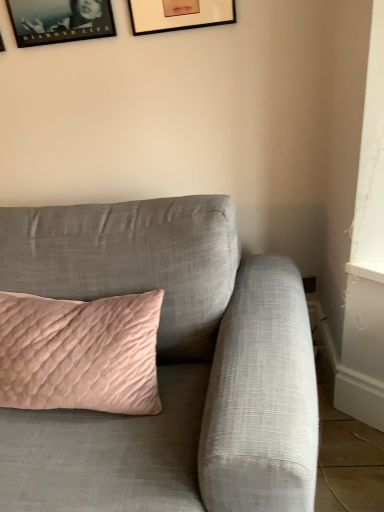
Identify the location of matte black picture frame at upper left, positioned as the 3th picture frame in right-to-left order. click(x=1, y=44).

Is matte black picture frame at upper left, which is counted as the first picture frame, starting from the left, taller or shorter than matte black picture frame at upper left, the second picture frame from the left?

In the image, matte black picture frame at upper left, which is counted as the first picture frame, starting from the left, appears to be taller than matte black picture frame at upper left, the second picture frame from the left.

Consider the image. Measure the distance between matte black picture frame at upper left, which is counted as the first picture frame, starting from the left, and matte black picture frame at upper left, placed as the 2th picture frame when sorted from right to left.

8.08 inches.

From a real-world perspective, is matte black picture frame at upper left, which is counted as the first picture frame, starting from the left, positioned under matte black picture frame at upper left, placed as the 2th picture frame when sorted from right to left, based on gravity?

Correct, in the physical world, matte black picture frame at upper left, which is counted as the first picture frame, starting from the left, is lower than matte black picture frame at upper left, placed as the 2th picture frame when sorted from right to left.

Is matte black picture frame at upper left, positioned as the 3th picture frame in right-to-left order, positioned before matte black picture frame at upper left, placed as the 2th picture frame when sorted from right to left?

No.

How different are the orientations of matte black picture frame at upper center, marked as the 3th picture frame in a left-to-right arrangement, and matte gray couch at center in degrees?

The facing directions of matte black picture frame at upper center, marked as the 3th picture frame in a left-to-right arrangement, and matte gray couch at center are 5.73 degrees apart.

How far apart are matte black picture frame at upper center, which appears as the first picture frame when viewed from the right, and matte gray couch at center?

They are 90.03 centimeters apart.

Does matte black picture frame at upper center, marked as the 3th picture frame in a left-to-right arrangement, have a larger size compared to matte gray couch at center?

Actually, matte black picture frame at upper center, marked as the 3th picture frame in a left-to-right arrangement, might be smaller than matte gray couch at center.

Locate an element on the screen. Image resolution: width=384 pixels, height=512 pixels. studio couch lying on the left of matte black picture frame at upper center, marked as the 3th picture frame in a left-to-right arrangement is located at coordinates (169, 365).

Would you say matte black picture frame at upper left, the second picture frame from the left, is to the left or to the right of matte gray couch at center in the picture?

In the image, matte black picture frame at upper left, the second picture frame from the left, appears on the left side of matte gray couch at center.

How different are the orientations of matte black picture frame at upper left, placed as the 2th picture frame when sorted from right to left, and matte gray couch at center in degrees?

They differ by 5.73 degrees in their facing directions.

Which is correct: matte black picture frame at upper left, placed as the 2th picture frame when sorted from right to left, is inside matte gray couch at center, or outside of it?

matte black picture frame at upper left, placed as the 2th picture frame when sorted from right to left, exists outside the volume of matte gray couch at center.

Does matte gray couch at center appear on the right side of matte black picture frame at upper left, the second picture frame from the left?

Correct, you'll find matte gray couch at center to the right of matte black picture frame at upper left, the second picture frame from the left.

How different are the orientations of matte gray couch at center and matte black picture frame at upper left, the second picture frame from the left, in degrees?

There is a 5.73-degree angle between the facing directions of matte gray couch at center and matte black picture frame at upper left, the second picture frame from the left.

Between matte gray couch at center and matte black picture frame at upper left, the second picture frame from the left, which one has less height?

matte black picture frame at upper left, the second picture frame from the left.

Based on the photo, considering the sizes of objects matte gray couch at center and matte black picture frame at upper left, placed as the 2th picture frame when sorted from right to left, in the image provided, who is thinner, matte gray couch at center or matte black picture frame at upper left, placed as the 2th picture frame when sorted from right to left,?

Thinner between the two is matte black picture frame at upper left, placed as the 2th picture frame when sorted from right to left.

Based on the photo, from the image's perspective, is matte black picture frame at upper left, which is counted as the first picture frame, starting from the left, on matte black picture frame at upper center, which appears as the first picture frame when viewed from the right?

No, from the image's perspective, matte black picture frame at upper left, which is counted as the first picture frame, starting from the left, is not on top of matte black picture frame at upper center, which appears as the first picture frame when viewed from the right.

Can you see matte black picture frame at upper left, which is counted as the first picture frame, starting from the left, touching matte black picture frame at upper center, marked as the 3th picture frame in a left-to-right arrangement?

No, matte black picture frame at upper left, which is counted as the first picture frame, starting from the left, is not touching matte black picture frame at upper center, marked as the 3th picture frame in a left-to-right arrangement.

This screenshot has width=384, height=512. I want to click on the 2nd picture frame in front of the matte black picture frame at upper left, which is counted as the first picture frame, starting from the left, so click(x=179, y=14).

Who is shorter, matte black picture frame at upper left, which is counted as the first picture frame, starting from the left, or matte black picture frame at upper center, which appears as the first picture frame when viewed from the right?

matte black picture frame at upper left, which is counted as the first picture frame, starting from the left, is shorter.

From a real-world perspective, is matte black picture frame at upper left, positioned as the 3th picture frame in right-to-left order, on matte gray couch at center?

Yes, from a real-world perspective, matte black picture frame at upper left, positioned as the 3th picture frame in right-to-left order, is on top of matte gray couch at center.

Which of these two, matte black picture frame at upper left, which is counted as the first picture frame, starting from the left, or matte gray couch at center, is smaller?

With smaller size is matte black picture frame at upper left, which is counted as the first picture frame, starting from the left.

There is a matte gray couch at center. What are the coordinates of `the 1st picture frame above it (from a real-world perspective)` in the screenshot? It's located at (1, 44).

Which is closer, (247, 371) or (4, 50)?

Point (247, 371) appears to be closer to the viewer than point (4, 50).

From a real-world perspective, is matte gray couch at center physically above matte black picture frame at upper left, positioned as the 3th picture frame in right-to-left order?

No, from a real-world perspective, matte gray couch at center is not over matte black picture frame at upper left, positioned as the 3th picture frame in right-to-left order

Where is `studio couch below the matte black picture frame at upper left, which is counted as the first picture frame, starting from the left (from a real-world perspective)`? studio couch below the matte black picture frame at upper left, which is counted as the first picture frame, starting from the left (from a real-world perspective) is located at coordinates (169, 365).

Is matte gray couch at center inside the boundaries of matte black picture frame at upper left, which is counted as the first picture frame, starting from the left, or outside?

The correct answer is: outside.

Starting from the matte black picture frame at upper left, which is counted as the first picture frame, starting from the left, which picture frame is the 1st one to the right? Please provide its 2D coordinates.

[(60, 20)]

You are a GUI agent. You are given a task and a screenshot of the screen. Output one action in this format:
    pyautogui.click(x=<x>, y=<y>)
    Task: Click on the 1st picture frame behind when counting from the matte gray couch at center
    Image resolution: width=384 pixels, height=512 pixels.
    Given the screenshot: What is the action you would take?
    pyautogui.click(x=179, y=14)

Estimate the real-world distances between objects in this image. Which object is closer to matte gray couch at center, matte black picture frame at upper left, which is counted as the first picture frame, starting from the left, or matte black picture frame at upper center, which appears as the first picture frame when viewed from the right?

matte black picture frame at upper center, which appears as the first picture frame when viewed from the right, is positioned closer to the anchor matte gray couch at center.

Consider the image. Considering their positions, is matte black picture frame at upper left, placed as the 2th picture frame when sorted from right to left, positioned further to matte black picture frame at upper center, which appears as the first picture frame when viewed from the right, than matte black picture frame at upper left, which is counted as the first picture frame, starting from the left?

Based on the image, matte black picture frame at upper left, which is counted as the first picture frame, starting from the left, appears to be further to matte black picture frame at upper center, which appears as the first picture frame when viewed from the right.

Which object lies further to the anchor point matte black picture frame at upper center, marked as the 3th picture frame in a left-to-right arrangement, matte gray couch at center or matte black picture frame at upper left, placed as the 2th picture frame when sorted from right to left?

matte gray couch at center is further to matte black picture frame at upper center, marked as the 3th picture frame in a left-to-right arrangement.

Looking at the image, which one is located further to matte black picture frame at upper left, placed as the 2th picture frame when sorted from right to left, matte black picture frame at upper left, positioned as the 3th picture frame in right-to-left order, or matte black picture frame at upper center, marked as the 3th picture frame in a left-to-right arrangement?

matte black picture frame at upper center, marked as the 3th picture frame in a left-to-right arrangement.

Based on their spatial positions, is matte black picture frame at upper left, positioned as the 3th picture frame in right-to-left order, or matte gray couch at center further from matte black picture frame at upper center, which appears as the first picture frame when viewed from the right?

matte gray couch at center lies further to matte black picture frame at upper center, which appears as the first picture frame when viewed from the right, than the other object.

Estimate the real-world distances between objects in this image. Which object is further from matte black picture frame at upper left, placed as the 2th picture frame when sorted from right to left, matte black picture frame at upper center, marked as the 3th picture frame in a left-to-right arrangement, or matte black picture frame at upper left, positioned as the 3th picture frame in right-to-left order?

Among the two, matte black picture frame at upper center, marked as the 3th picture frame in a left-to-right arrangement, is located further to matte black picture frame at upper left, placed as the 2th picture frame when sorted from right to left.

Looking at the image, which one is located closer to matte black picture frame at upper left, which is counted as the first picture frame, starting from the left, matte black picture frame at upper center, which appears as the first picture frame when viewed from the right, or matte black picture frame at upper left, placed as the 2th picture frame when sorted from right to left?

Among the two, matte black picture frame at upper left, placed as the 2th picture frame when sorted from right to left, is located nearer to matte black picture frame at upper left, which is counted as the first picture frame, starting from the left.

Considering their positions, is matte gray couch at center positioned closer to matte black picture frame at upper left, which is counted as the first picture frame, starting from the left, than matte black picture frame at upper left, placed as the 2th picture frame when sorted from right to left?

matte black picture frame at upper left, placed as the 2th picture frame when sorted from right to left, lies closer to matte black picture frame at upper left, which is counted as the first picture frame, starting from the left, than the other object.

Identify the location of picture frame between matte black picture frame at upper left, positioned as the 3th picture frame in right-to-left order, and matte black picture frame at upper center, marked as the 3th picture frame in a left-to-right arrangement, from left to right. (60, 20).

This screenshot has height=512, width=384. What are the coordinates of `picture frame between matte black picture frame at upper left, placed as the 2th picture frame when sorted from right to left, and matte gray couch at center in the up-down direction` in the screenshot? It's located at (1, 44).